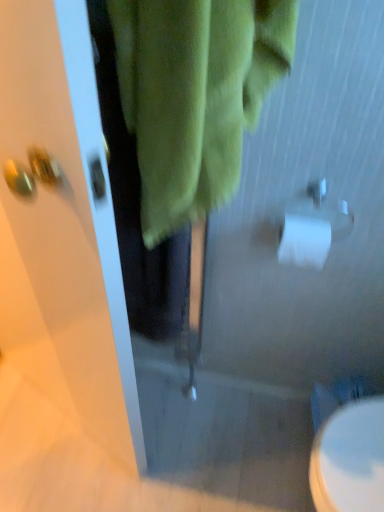
Question: Is white glossy toilet at lower right next to white matte toilet paper at right?

Choices:
 (A) yes
 (B) no

Answer: (B)

Question: From a real-world perspective, is white glossy toilet at lower right physically below white matte toilet paper at right?

Choices:
 (A) yes
 (B) no

Answer: (A)

Question: From a real-world perspective, is white glossy toilet at lower right on top of white matte toilet paper at right?

Choices:
 (A) yes
 (B) no

Answer: (B)

Question: From the image's perspective, is white glossy toilet at lower right on top of white matte toilet paper at right?

Choices:
 (A) no
 (B) yes

Answer: (A)

Question: Is the depth of white glossy toilet at lower right greater than that of white matte toilet paper at right?

Choices:
 (A) no
 (B) yes

Answer: (B)

Question: Can you confirm if white glossy toilet at lower right is wider than white matte toilet paper at right?

Choices:
 (A) yes
 (B) no

Answer: (A)

Question: Can you confirm if white matte toilet paper at right is shorter than white glossy toilet at lower right?

Choices:
 (A) no
 (B) yes

Answer: (B)

Question: Is white glossy toilet at lower right at the back of white matte toilet paper at right?

Choices:
 (A) no
 (B) yes

Answer: (A)

Question: Would you say white matte toilet paper at right contains white glossy toilet at lower right?

Choices:
 (A) yes
 (B) no

Answer: (B)

Question: Would you say white matte toilet paper at right is a long distance from white glossy toilet at lower right?

Choices:
 (A) yes
 (B) no

Answer: (B)

Question: Does white matte toilet paper at right come behind white glossy toilet at lower right?

Choices:
 (A) yes
 (B) no

Answer: (B)

Question: Is white matte toilet paper at right directly adjacent to white glossy toilet at lower right?

Choices:
 (A) no
 (B) yes

Answer: (A)

Question: Do you think white matte toilet paper at right is within white glossy toilet at lower right, or outside of it?

Choices:
 (A) outside
 (B) inside

Answer: (A)